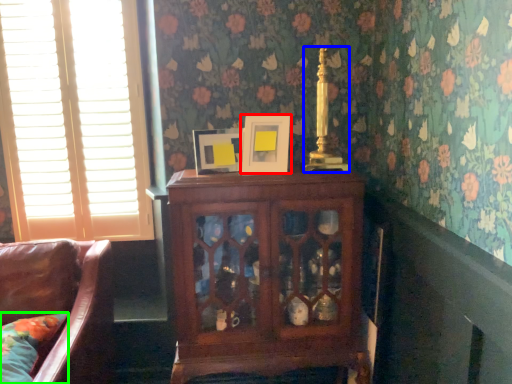
Question: Which object is the closest to the picture frame (highlighted by a red box)? Choose among these: candle holder (highlighted by a blue box) or pillow (highlighted by a green box).

Choices:
 (A) candle holder
 (B) pillow

Answer: (A)